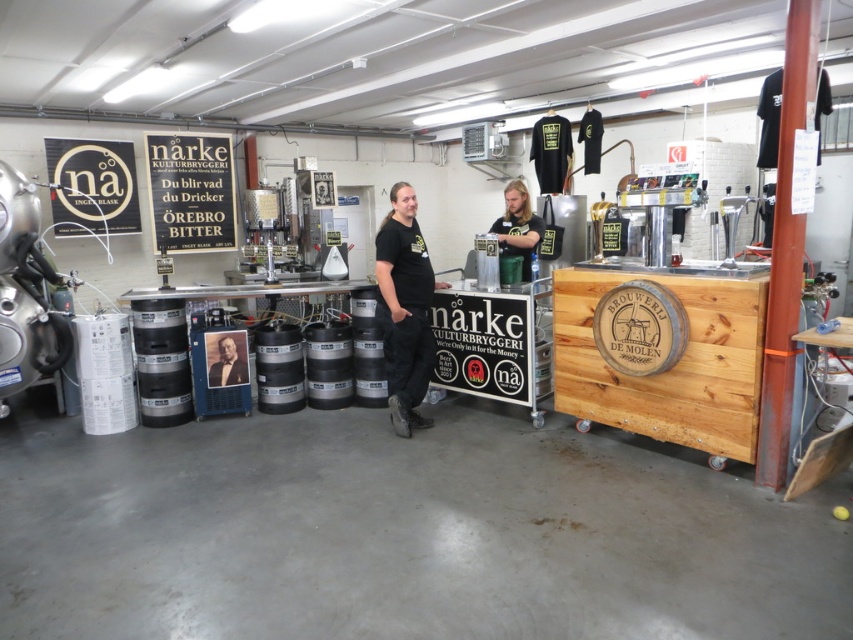
Question: Does dark brown leather jacket at center appear under formal black suit at center?

Choices:
 (A) no
 (B) yes

Answer: (A)

Question: Which is nearer to the formal black suit at center?

Choices:
 (A) black matte shirt at center
 (B) dark brown leather jacket at center

Answer: (A)

Question: Which of the following is the farthest from the observer?

Choices:
 (A) dark brown leather jacket at center
 (B) formal black suit at center

Answer: (B)

Question: Does black matte shirt at center appear on the right side of formal black suit at center?

Choices:
 (A) no
 (B) yes

Answer: (B)

Question: Is black matte shirt at center to the left of formal black suit at center from the viewer's perspective?

Choices:
 (A) no
 (B) yes

Answer: (A)

Question: Which point is farther to the camera?

Choices:
 (A) black matte shirt at center
 (B) formal black suit at center

Answer: (B)